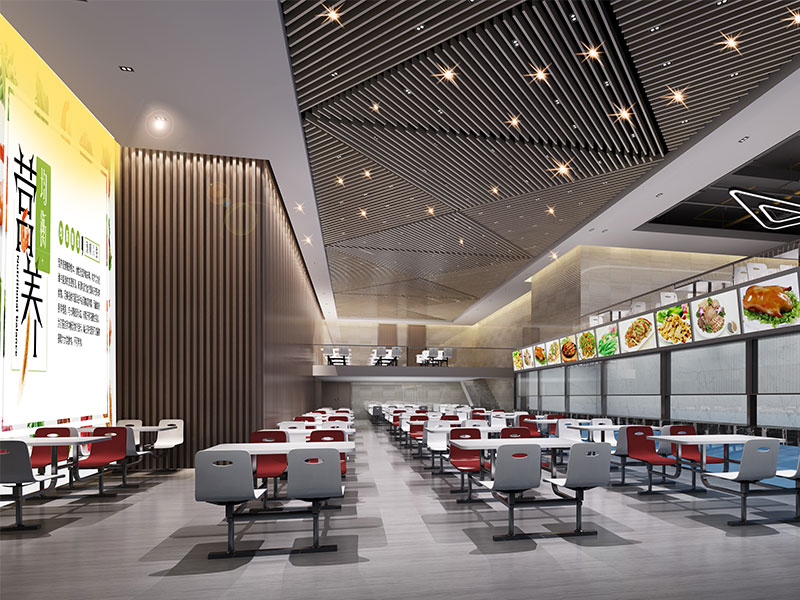
Where is `window blind`? The height and width of the screenshot is (600, 800). window blind is located at coordinates (526, 384), (545, 380), (589, 381), (632, 387), (710, 379), (770, 365).